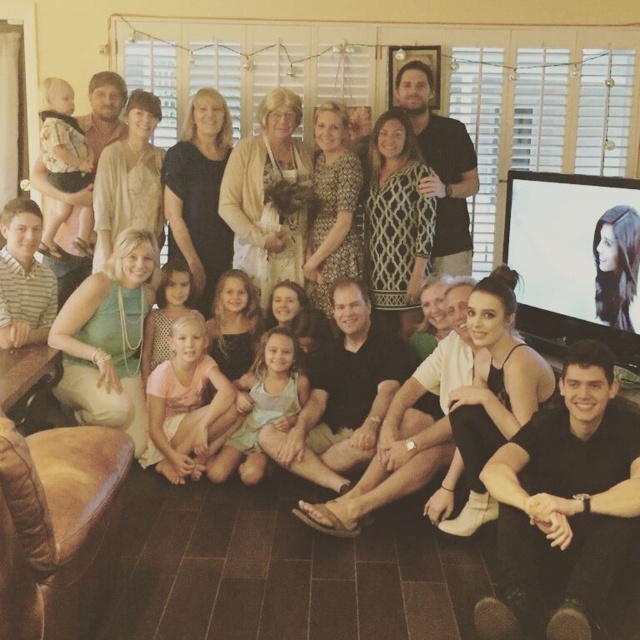
You are a photographer standing near the camera in the living room. You want to take a photo of the light brown fabric baby carrier at left without moving. Can you reach it with your camera lens?

The light brown fabric baby carrier at left and camera are 3.85 meters apart from each other, so the photographer can reach it with their camera lens since most standard lenses can focus at that distance.

You are a photographer setting up for a group photo. You need to ensure that the pink cotton shirt at center and the light brown fabric baby carrier at left are both visible in the frame. Based on their heights, which object might require you to adjust your camera angle to capture both effectively?

The light brown fabric baby carrier at left is taller than the pink cotton shirt at center, so you might need to lower the camera angle slightly to ensure the taller baby carrier is fully visible without cropping it, while still including the pink cotton shirt at center in the frame.

You are a photographer setting up for a group photo in this living room. You notice the light brown fabric baby carrier at left and the light pink fabric dress at center. Which object should you position closer to the camera to ensure both are fully visible in the photo?

The light brown fabric baby carrier at left is much taller than the light pink fabric dress at center, so positioning the light brown fabric baby carrier at left closer to the camera will ensure both are fully visible in the photo.